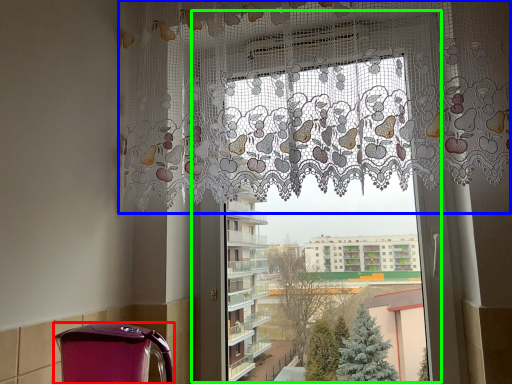
Question: Which is nearer to the appliance (highlighted by a red box)? curtain (highlighted by a blue box) or window frame (highlighted by a green box).

Choices:
 (A) curtain
 (B) window frame

Answer: (B)